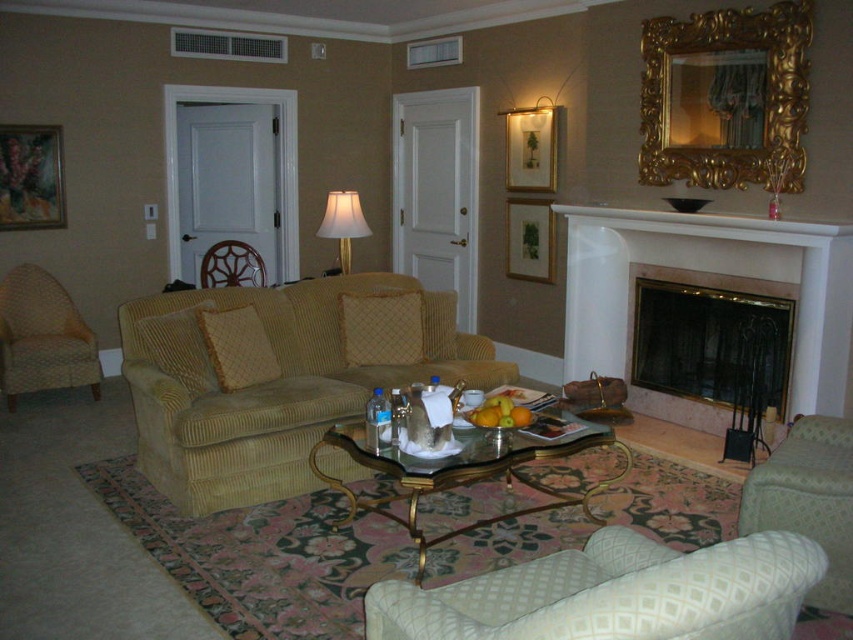
You are standing at the sofa and want to reach the coffee table. There are two points marked in the room, point A at coordinates point (846, 241) and point B at coordinates point (732, 381). Which point should you pass through to get to the coffee table?

Point A at coordinates point (846, 241) is in front of point B at coordinates point (732, 381), so you should pass through point A to reach the coffee table.